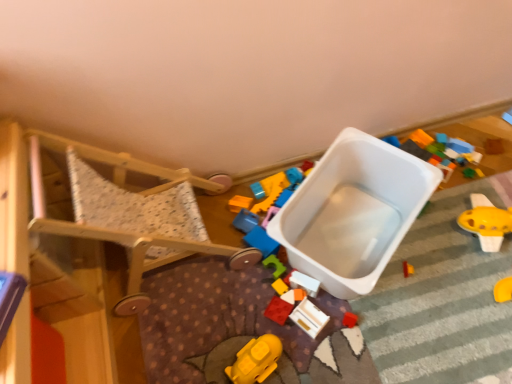
Find the location of a particular element. This screenshot has height=384, width=512. vacant space in front of yellow plastic toy at right, which is counted as the first toy, starting from the right is located at coordinates (484, 290).